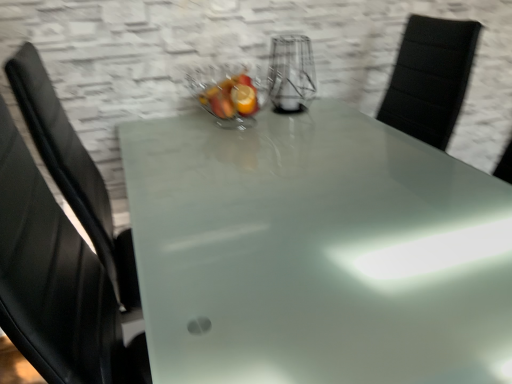
Question: In the image, is clear glass bowl at center positioned in front of or behind frosted glass table at center?

Choices:
 (A) front
 (B) behind

Answer: (B)

Question: Considering the positions of clear glass bowl at center and frosted glass table at center in the image, is clear glass bowl at center wider or thinner than frosted glass table at center?

Choices:
 (A) thin
 (B) wide

Answer: (A)

Question: Which of these objects is positioned farthest from the clear glass vase at center?

Choices:
 (A) frosted glass table at center
 (B) clear glass bowl at center

Answer: (A)

Question: Estimate the real-world distances between objects in this image. Which object is farther from the clear glass bowl at center?

Choices:
 (A) frosted glass table at center
 (B) clear glass vase at center

Answer: (A)